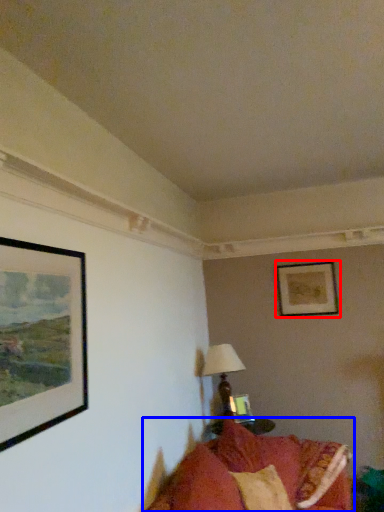
Question: Which of the following is the closest to the observer, picture frame (highlighted by a red box) or studio couch (highlighted by a blue box)?

Choices:
 (A) picture frame
 (B) studio couch

Answer: (B)